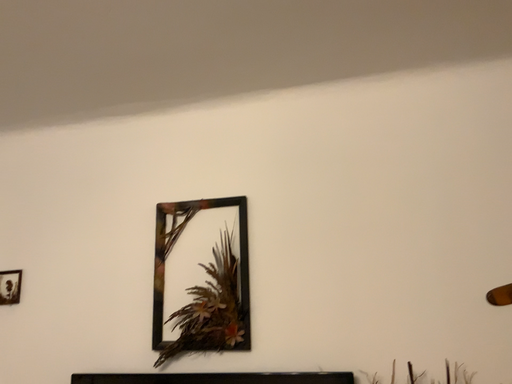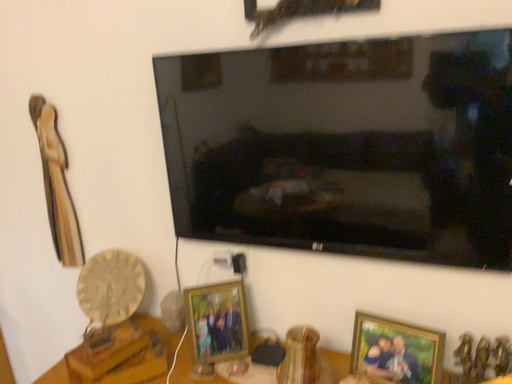
Question: How did the camera likely rotate when shooting the video?

Choices:
 (A) rotated upward
 (B) rotated downward

Answer: (B)